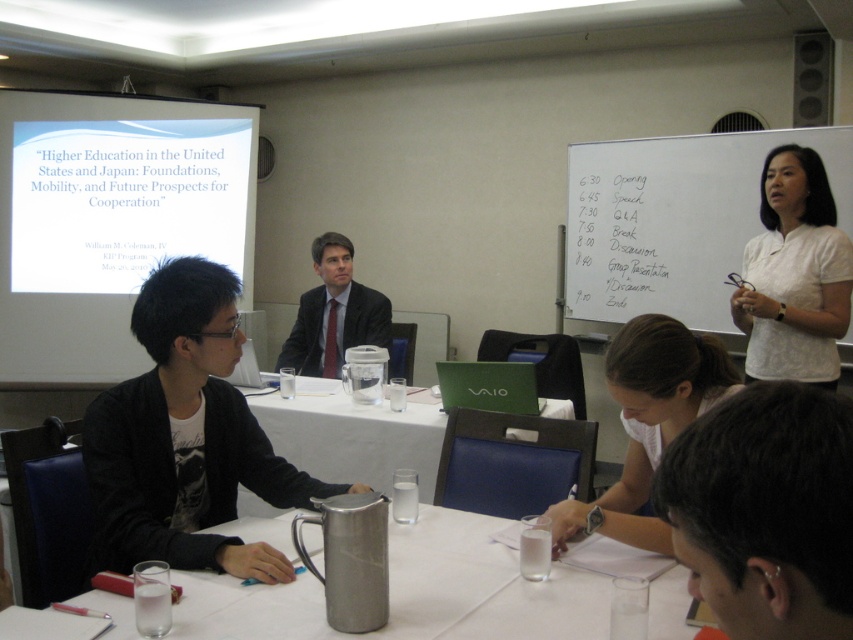
Question: Is white matte projection screen at upper left positioned at the back of white matte shirt at center?

Choices:
 (A) no
 (B) yes

Answer: (B)

Question: Can you confirm if silver metallic pitcher at center is positioned above white matte shirt at center?

Choices:
 (A) no
 (B) yes

Answer: (A)

Question: Which point is farther to the camera?

Choices:
 (A) white matte shirt at center
 (B) white cotton shirt at upper right

Answer: (B)

Question: Which is farther from the white cotton shirt at upper right?

Choices:
 (A) white matte projection screen at upper left
 (B) white matte shirt at center

Answer: (A)

Question: Which object is positioned closest to the white matte shirt at center?

Choices:
 (A) dark suit at center
 (B) white cotton shirt at upper right
 (C) white plastic table at center

Answer: (B)

Question: Does black fabric jacket at center appear on the left side of dark hair at lower right?

Choices:
 (A) no
 (B) yes

Answer: (B)